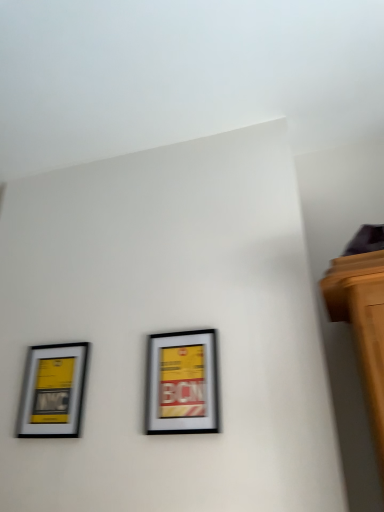
What do you see at coordinates (182, 383) in the screenshot? This screenshot has width=384, height=512. I see `matte silver picture frame at center, positioned as the 1th picture frame in right-to-left order` at bounding box center [182, 383].

You are a GUI agent. You are given a task and a screenshot of the screen. Output one action in this format:
    pyautogui.click(x=<x>, y=<y>)
    Task: Click on the matte silver picture frame at center, which appears as the 2th picture frame when viewed from the left
    This screenshot has width=384, height=512.
    Given the screenshot: What is the action you would take?
    pyautogui.click(x=182, y=383)

Image resolution: width=384 pixels, height=512 pixels. Describe the element at coordinates (53, 391) in the screenshot. I see `matte black picture frame at left, the second picture frame viewed from the right` at that location.

Locate an element on the screen. The image size is (384, 512). matte black picture frame at left, arranged as the 1th picture frame when viewed from the left is located at coordinates (53, 391).

Where is `matte silver picture frame at center, which appears as the 2th picture frame when viewed from the left`? matte silver picture frame at center, which appears as the 2th picture frame when viewed from the left is located at coordinates (182, 383).

Considering the relative positions of matte silver picture frame at center, positioned as the 1th picture frame in right-to-left order, and matte black picture frame at left, the second picture frame viewed from the right, in the image provided, is matte silver picture frame at center, positioned as the 1th picture frame in right-to-left order, to the left or to the right of matte black picture frame at left, the second picture frame viewed from the right,?

Clearly, matte silver picture frame at center, positioned as the 1th picture frame in right-to-left order, is on the right of matte black picture frame at left, the second picture frame viewed from the right, in the image.

Considering the positions of objects matte silver picture frame at center, which appears as the 2th picture frame when viewed from the left, and matte black picture frame at left, the second picture frame viewed from the right, in the image provided, who is behind, matte silver picture frame at center, which appears as the 2th picture frame when viewed from the left, or matte black picture frame at left, the second picture frame viewed from the right,?

matte black picture frame at left, the second picture frame viewed from the right, is more distant.

Which is nearer, (150,408) or (34,413)?

Point (150,408).

From the image's perspective, is matte silver picture frame at center, positioned as the 1th picture frame in right-to-left order, positioned above or below matte black picture frame at left, the second picture frame viewed from the right?

Clearly, from the image's perspective, matte silver picture frame at center, positioned as the 1th picture frame in right-to-left order, is above matte black picture frame at left, the second picture frame viewed from the right.

From a real-world perspective, is matte silver picture frame at center, positioned as the 1th picture frame in right-to-left order, below matte black picture frame at left, the second picture frame viewed from the right?

Yes, from a real-world perspective, matte silver picture frame at center, positioned as the 1th picture frame in right-to-left order, is under matte black picture frame at left, the second picture frame viewed from the right.

Between matte silver picture frame at center, which appears as the 2th picture frame when viewed from the left, and matte black picture frame at left, arranged as the 1th picture frame when viewed from the left, which one has larger width?

matte silver picture frame at center, which appears as the 2th picture frame when viewed from the left, is wider.

Looking at this image, in terms of height, does matte silver picture frame at center, positioned as the 1th picture frame in right-to-left order, look taller or shorter compared to matte black picture frame at left, the second picture frame viewed from the right?

Considering their sizes, matte silver picture frame at center, positioned as the 1th picture frame in right-to-left order, has more height than matte black picture frame at left, the second picture frame viewed from the right.

In the scene shown: Does matte silver picture frame at center, positioned as the 1th picture frame in right-to-left order, have a larger size compared to matte black picture frame at left, arranged as the 1th picture frame when viewed from the left?

No.

Is matte silver picture frame at center, positioned as the 1th picture frame in right-to-left order, positioned beyond the bounds of matte black picture frame at left, arranged as the 1th picture frame when viewed from the left?

Indeed, matte silver picture frame at center, positioned as the 1th picture frame in right-to-left order, is completely outside matte black picture frame at left, arranged as the 1th picture frame when viewed from the left.

Is matte silver picture frame at center, which appears as the 2th picture frame when viewed from the left, beside matte black picture frame at left, arranged as the 1th picture frame when viewed from the left?

There is a gap between matte silver picture frame at center, which appears as the 2th picture frame when viewed from the left, and matte black picture frame at left, arranged as the 1th picture frame when viewed from the left.

Is matte black picture frame at left, the second picture frame viewed from the right, at the back of matte silver picture frame at center, which appears as the 2th picture frame when viewed from the left?

That's not correct — matte silver picture frame at center, which appears as the 2th picture frame when viewed from the left, is not looking away from matte black picture frame at left, the second picture frame viewed from the right.

Identify the location of picture frame directly beneath the matte black picture frame at left, the second picture frame viewed from the right (from a real-world perspective). pyautogui.click(x=182, y=383).

Visually, is matte black picture frame at left, arranged as the 1th picture frame when viewed from the left, positioned to the left or to the right of matte silver picture frame at center, which appears as the 2th picture frame when viewed from the left?

Clearly, matte black picture frame at left, arranged as the 1th picture frame when viewed from the left, is on the left of matte silver picture frame at center, which appears as the 2th picture frame when viewed from the left, in the image.

Looking at this image, is matte black picture frame at left, arranged as the 1th picture frame when viewed from the left, behind matte silver picture frame at center, which appears as the 2th picture frame when viewed from the left?

Yes, matte black picture frame at left, arranged as the 1th picture frame when viewed from the left, is further from the viewer.

Is point (47, 373) closer or farther from the camera than point (172, 407)?

Point (47, 373) is positioned farther from the camera compared to point (172, 407).

From the image's perspective, which is below, matte black picture frame at left, arranged as the 1th picture frame when viewed from the left, or matte silver picture frame at center, positioned as the 1th picture frame in right-to-left order?

matte black picture frame at left, arranged as the 1th picture frame when viewed from the left.

From a real-world perspective, is matte black picture frame at left, arranged as the 1th picture frame when viewed from the left, located higher than matte silver picture frame at center, positioned as the 1th picture frame in right-to-left order?

Correct, in the physical world, matte black picture frame at left, arranged as the 1th picture frame when viewed from the left, is higher than matte silver picture frame at center, positioned as the 1th picture frame in right-to-left order.

Consider the image. Is matte black picture frame at left, arranged as the 1th picture frame when viewed from the left, wider or thinner than matte silver picture frame at center, positioned as the 1th picture frame in right-to-left order?

matte black picture frame at left, arranged as the 1th picture frame when viewed from the left, is thinner than matte silver picture frame at center, positioned as the 1th picture frame in right-to-left order.

Who is taller, matte black picture frame at left, the second picture frame viewed from the right, or matte silver picture frame at center, positioned as the 1th picture frame in right-to-left order?

Standing taller between the two is matte silver picture frame at center, positioned as the 1th picture frame in right-to-left order.

Can you confirm if matte black picture frame at left, arranged as the 1th picture frame when viewed from the left, is bigger than matte silver picture frame at center, positioned as the 1th picture frame in right-to-left order?

Indeed, matte black picture frame at left, arranged as the 1th picture frame when viewed from the left, has a larger size compared to matte silver picture frame at center, positioned as the 1th picture frame in right-to-left order.

Looking at this image, is matte black picture frame at left, the second picture frame viewed from the right, not within matte silver picture frame at center, which appears as the 2th picture frame when viewed from the left?

Yes, matte black picture frame at left, the second picture frame viewed from the right, is outside of matte silver picture frame at center, which appears as the 2th picture frame when viewed from the left.

Would you say matte black picture frame at left, arranged as the 1th picture frame when viewed from the left, is a long distance from matte silver picture frame at center, positioned as the 1th picture frame in right-to-left order?

No, matte black picture frame at left, arranged as the 1th picture frame when viewed from the left, is not far from matte silver picture frame at center, positioned as the 1th picture frame in right-to-left order.

Could you tell me if matte black picture frame at left, arranged as the 1th picture frame when viewed from the left, is facing matte silver picture frame at center, positioned as the 1th picture frame in right-to-left order?

No, matte black picture frame at left, arranged as the 1th picture frame when viewed from the left, does not turn towards matte silver picture frame at center, positioned as the 1th picture frame in right-to-left order.

Can you tell me how much matte black picture frame at left, the second picture frame viewed from the right, and matte silver picture frame at center, positioned as the 1th picture frame in right-to-left order, differ in facing direction?

There is a 93-degree angle between the facing directions of matte black picture frame at left, the second picture frame viewed from the right, and matte silver picture frame at center, positioned as the 1th picture frame in right-to-left order.

How far apart are matte black picture frame at left, the second picture frame viewed from the right, and matte silver picture frame at center, positioned as the 1th picture frame in right-to-left order?

matte black picture frame at left, the second picture frame viewed from the right, is 48.38 centimeters away from matte silver picture frame at center, positioned as the 1th picture frame in right-to-left order.

The height and width of the screenshot is (512, 384). Identify the location of picture frame on the right side of matte black picture frame at left, arranged as the 1th picture frame when viewed from the left. (182, 383).

Identify the location of picture frame below the matte black picture frame at left, arranged as the 1th picture frame when viewed from the left (from a real-world perspective). Image resolution: width=384 pixels, height=512 pixels. (182, 383).

This screenshot has height=512, width=384. Identify the location of picture frame above the matte silver picture frame at center, which appears as the 2th picture frame when viewed from the left (from a real-world perspective). pos(53,391).